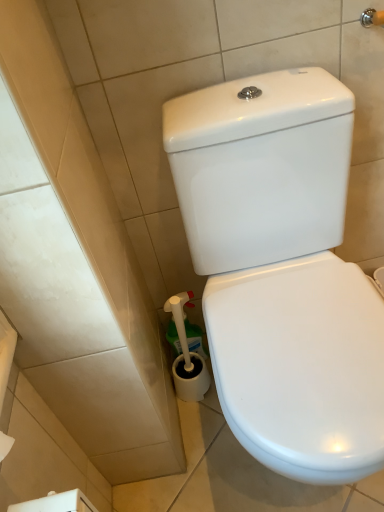
Measure the distance between white glossy toilet at center and camera.

white glossy toilet at center is 24.13 inches from camera.

At what (x,y) coordinates should I click in order to perform the action: click on white glossy toilet at center. Please return your answer as a coordinate pair (x, y). Looking at the image, I should click on (282, 270).

The image size is (384, 512). Describe the element at coordinates (282, 270) in the screenshot. I see `white glossy toilet at center` at that location.

What do you see at coordinates (187, 355) in the screenshot? I see `white plastic toilet brush at lower left` at bounding box center [187, 355].

Locate an element on the screen. Image resolution: width=384 pixels, height=512 pixels. white plastic toilet brush at lower left is located at coordinates (187, 355).

This screenshot has height=512, width=384. In order to click on white glossy toilet at center in this screenshot , I will do `click(282, 270)`.

Is white plastic toilet brush at lower left to the left of white glossy toilet at center from the viewer's perspective?

Indeed, white plastic toilet brush at lower left is positioned on the left side of white glossy toilet at center.

Considering their positions, is white plastic toilet brush at lower left located in front of or behind white glossy toilet at center?

Clearly, white plastic toilet brush at lower left is behind white glossy toilet at center.

Is point (189, 389) farther from viewer compared to point (173, 139)?

Yes.

From the image's perspective, is white plastic toilet brush at lower left located beneath white glossy toilet at center?

Yes.

From a real-world perspective, is white plastic toilet brush at lower left positioned above or below white glossy toilet at center?

Clearly, from a real-world perspective, white plastic toilet brush at lower left is below white glossy toilet at center.

Which of these two, white plastic toilet brush at lower left or white glossy toilet at center, is wider?

With larger width is white glossy toilet at center.

Between white plastic toilet brush at lower left and white glossy toilet at center, which one has less height?

white plastic toilet brush at lower left.

Between white plastic toilet brush at lower left and white glossy toilet at center, which one has smaller size?

white plastic toilet brush at lower left is smaller.

Is white plastic toilet brush at lower left inside or outside of white glossy toilet at center?

white plastic toilet brush at lower left exists outside the volume of white glossy toilet at center.

Consider the image. Would you say white plastic toilet brush at lower left is a long distance from white glossy toilet at center?

That's not correct — white plastic toilet brush at lower left is a little close to white glossy toilet at center.

Is white plastic toilet brush at lower left aimed at white glossy toilet at center?

No, white plastic toilet brush at lower left is not facing towards white glossy toilet at center.

What's the angular difference between white plastic toilet brush at lower left and white glossy toilet at center's facing directions?

1.1 degrees.

Measure the distance between white plastic toilet brush at lower left and white glossy toilet at center.

14.36 inches.

In the image, there is a white plastic toilet brush at lower left. Where is `toilet above it (from the image's perspective)`? toilet above it (from the image's perspective) is located at coordinates (282, 270).

Does white glossy toilet at center appear on the left side of white plastic toilet brush at lower left?

Incorrect, white glossy toilet at center is not on the left side of white plastic toilet brush at lower left.

Is the position of white glossy toilet at center more distant than that of white plastic toilet brush at lower left?

No, it is not.

Is point (270, 370) closer or farther from the camera than point (180, 314)?

Point (270, 370).

From the image's perspective, who appears lower, white glossy toilet at center or white plastic toilet brush at lower left?

white plastic toilet brush at lower left.

From a real-world perspective, relative to white plastic toilet brush at lower left, is white glossy toilet at center vertically above or below?

In terms of real-world spatial position, white glossy toilet at center is above white plastic toilet brush at lower left.

Can you confirm if white glossy toilet at center is wider than white plastic toilet brush at lower left?

Correct, the width of white glossy toilet at center exceeds that of white plastic toilet brush at lower left.

Who is shorter, white glossy toilet at center or white plastic toilet brush at lower left?

white plastic toilet brush at lower left.

Is white glossy toilet at center bigger or smaller than white plastic toilet brush at lower left?

Considering their sizes, white glossy toilet at center takes up more space than white plastic toilet brush at lower left.

Is white glossy toilet at center not within white plastic toilet brush at lower left?

white glossy toilet at center is positioned outside white plastic toilet brush at lower left.

Is there a large distance between white glossy toilet at center and white plastic toilet brush at lower left?

white glossy toilet at center is actually quite close to white plastic toilet brush at lower left.

Could you tell me if white glossy toilet at center is facing white plastic toilet brush at lower left?

No, white glossy toilet at center is not aimed at white plastic toilet brush at lower left.

What's the angular difference between white glossy toilet at center and white plastic toilet brush at lower left's facing directions?

1.1 degrees.

Where is `brush that appears below the white glossy toilet at center (from the image's perspective)`? brush that appears below the white glossy toilet at center (from the image's perspective) is located at coordinates (187, 355).

Where is `brush below the white glossy toilet at center (from a real-world perspective)`? The image size is (384, 512). brush below the white glossy toilet at center (from a real-world perspective) is located at coordinates (187, 355).

I want to click on brush behind the white glossy toilet at center, so click(187, 355).